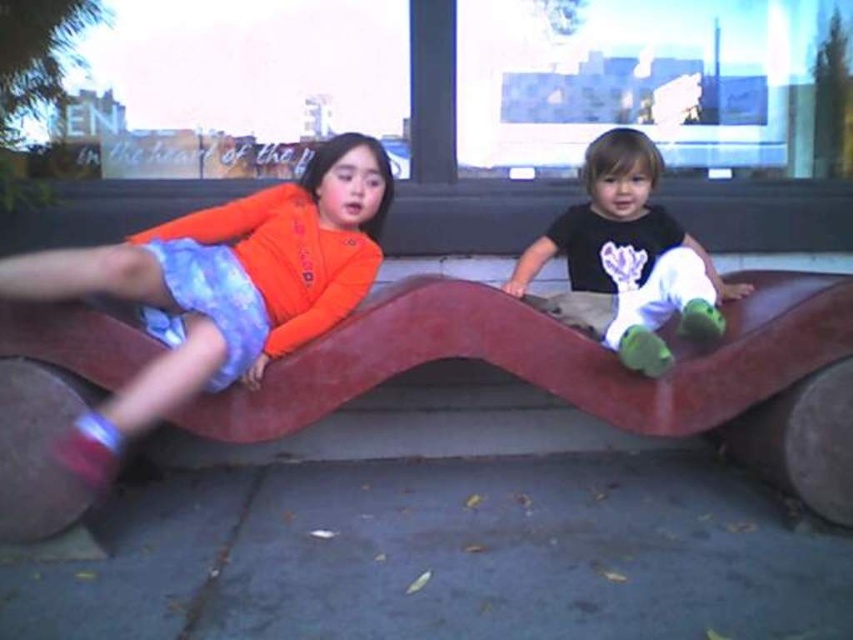
Question: Is matte orange shirt at upper left to the left of matte black shirt at upper right from the viewer's perspective?

Choices:
 (A) no
 (B) yes

Answer: (B)

Question: Is matte orange shirt at upper left to the right of matte black shirt at upper right from the viewer's perspective?

Choices:
 (A) no
 (B) yes

Answer: (A)

Question: In this image, where is matte orange shirt at upper left located relative to matte black shirt at upper right?

Choices:
 (A) above
 (B) below

Answer: (B)